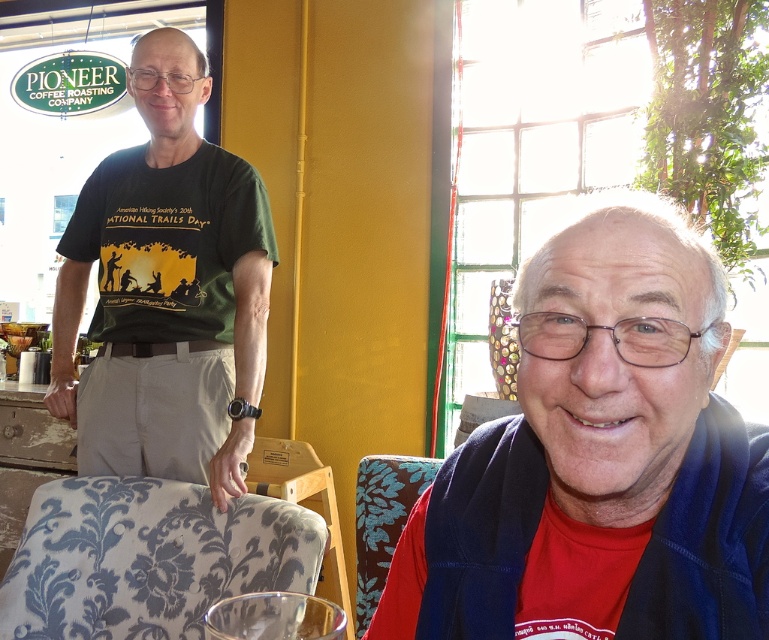
Which is more to the right, red matte vest at center or green matte t-shirt at center?

From the viewer's perspective, red matte vest at center appears more on the right side.

The height and width of the screenshot is (640, 769). What do you see at coordinates (598, 460) in the screenshot? I see `red matte vest at center` at bounding box center [598, 460].

At what (x,y) coordinates should I click in order to perform the action: click on red matte vest at center. Please return your answer as a coordinate pair (x, y). Looking at the image, I should click on (598, 460).

Where is `red matte vest at center`? This screenshot has width=769, height=640. red matte vest at center is located at coordinates (598, 460).